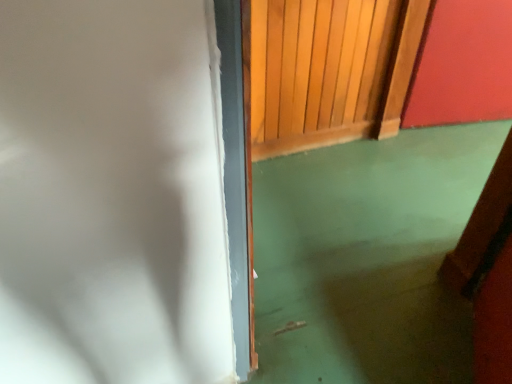
Where is `green smooth concrete at center`? green smooth concrete at center is located at coordinates (367, 257).

What do you see at coordinates (367, 257) in the screenshot?
I see `green smooth concrete at center` at bounding box center [367, 257].

In order to click on green smooth concrete at center in this screenshot , I will do `click(367, 257)`.